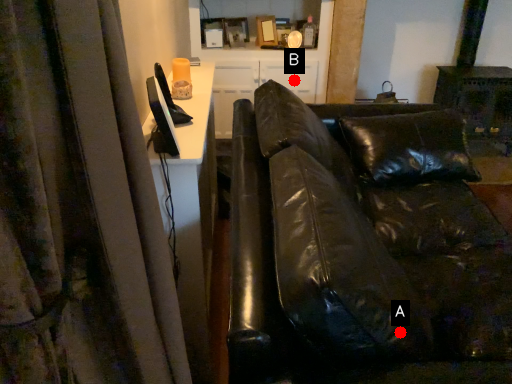
Question: Two points are circled on the image, labeled by A and B beside each circle. Which point appears closest to the camera in this image?

Choices:
 (A) A is closer
 (B) B is closer

Answer: (A)